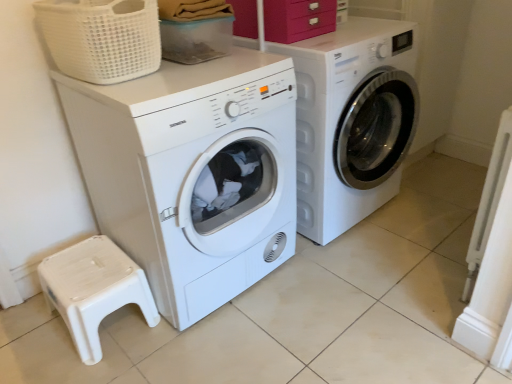
Question: From the image's perspective, relative to white woven basket at upper left, is matte pink drawer at upper center above or below?

Choices:
 (A) above
 (B) below

Answer: (A)

Question: Is matte pink drawer at upper center taller or shorter than white woven basket at upper left?

Choices:
 (A) tall
 (B) short

Answer: (B)

Question: Considering the real-world distances, which object is farthest from the white glossy washing machine at center, the first washing machine positioned from the right?

Choices:
 (A) white matte washing machine at left, which ranks as the first washing machine in left-to-right order
 (B) matte pink drawer at upper center
 (C) white woven basket at upper left
 (D) white plastic step stool at lower left
 (E) translucent plastic container at upper center

Answer: (D)

Question: Which object is positioned closest to the white plastic step stool at lower left?

Choices:
 (A) matte pink drawer at upper center
 (B) translucent plastic container at upper center
 (C) white matte washing machine at left, which ranks as the first washing machine in left-to-right order
 (D) white glossy washing machine at center, marked as the 2th washing machine in a left-to-right arrangement
 (E) white woven basket at upper left

Answer: (C)